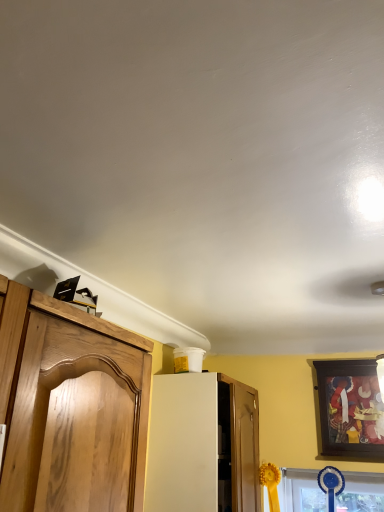
Question: From the image's perspective, does wooden picture frame at upper right appear lower than white matte cabinet at center?

Choices:
 (A) yes
 (B) no

Answer: (B)

Question: Is wooden picture frame at upper right smaller than white matte cabinet at center?

Choices:
 (A) no
 (B) yes

Answer: (B)

Question: Is wooden picture frame at upper right taller than white matte cabinet at center?

Choices:
 (A) no
 (B) yes

Answer: (A)

Question: Is wooden picture frame at upper right to the right of white matte cabinet at center from the viewer's perspective?

Choices:
 (A) yes
 (B) no

Answer: (A)

Question: Could you tell me if wooden picture frame at upper right is facing white matte cabinet at center?

Choices:
 (A) no
 (B) yes

Answer: (A)

Question: Considering the relative positions of wooden picture frame at upper right and white matte cabinet at center in the image provided, is wooden picture frame at upper right in front of white matte cabinet at center?

Choices:
 (A) yes
 (B) no

Answer: (B)

Question: From a real-world perspective, is white matte cabinet at center under wooden picture frame at upper right?

Choices:
 (A) no
 (B) yes

Answer: (B)

Question: Can you confirm if white matte cabinet at center is positioned to the left of wooden picture frame at upper right?

Choices:
 (A) yes
 (B) no

Answer: (A)

Question: Is white matte cabinet at center oriented away from wooden picture frame at upper right?

Choices:
 (A) yes
 (B) no

Answer: (B)

Question: Does white matte cabinet at center have a greater width compared to wooden picture frame at upper right?

Choices:
 (A) no
 (B) yes

Answer: (B)

Question: Considering the relative positions of white matte cabinet at center and wooden picture frame at upper right in the image provided, is white matte cabinet at center to the right of wooden picture frame at upper right from the viewer's perspective?

Choices:
 (A) no
 (B) yes

Answer: (A)

Question: Can you confirm if white matte cabinet at center is shorter than wooden picture frame at upper right?

Choices:
 (A) no
 (B) yes

Answer: (A)

Question: Is white matte cabinet at center taller or shorter than wooden picture frame at upper right?

Choices:
 (A) short
 (B) tall

Answer: (B)